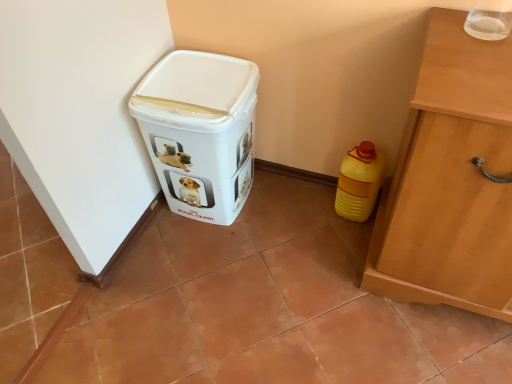
I want to click on vacant area that lies between white plastic container at lower left and yellow plastic bottle at lower right, so click(x=291, y=208).